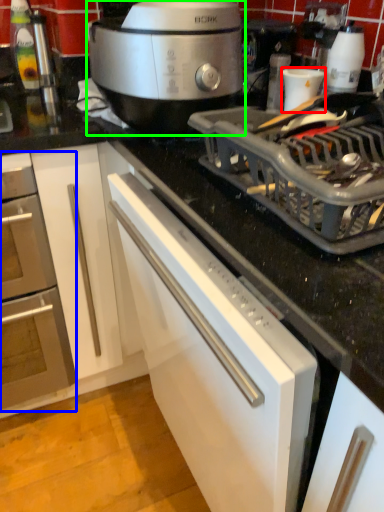
Question: Which object is the closest to the appliance (highlighted by a red box)? Choose among these: home appliance (highlighted by a blue box) or slow cooker (highlighted by a green box).

Choices:
 (A) home appliance
 (B) slow cooker

Answer: (B)